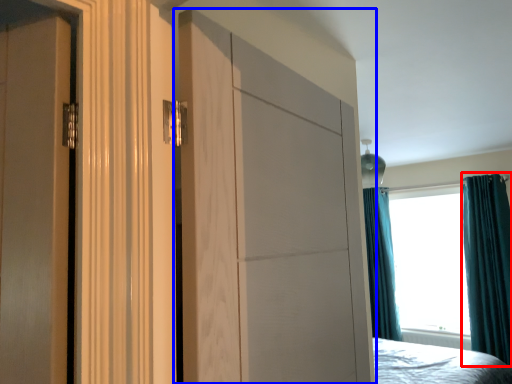
Question: Which point is closer to the camera, curtain (highlighted by a red box) or door (highlighted by a blue box)?

Choices:
 (A) curtain
 (B) door

Answer: (B)